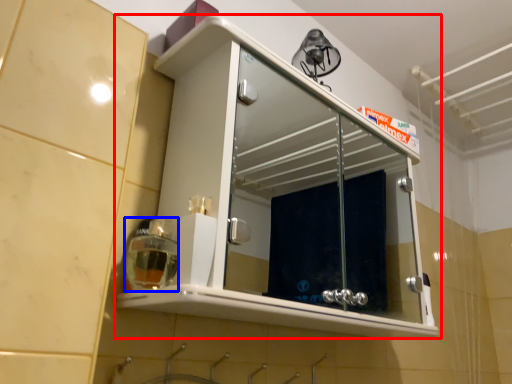
Question: Which point is further to the camera, cabinetry (highlighted by a red box) or soap dispenser (highlighted by a blue box)?

Choices:
 (A) cabinetry
 (B) soap dispenser

Answer: (B)